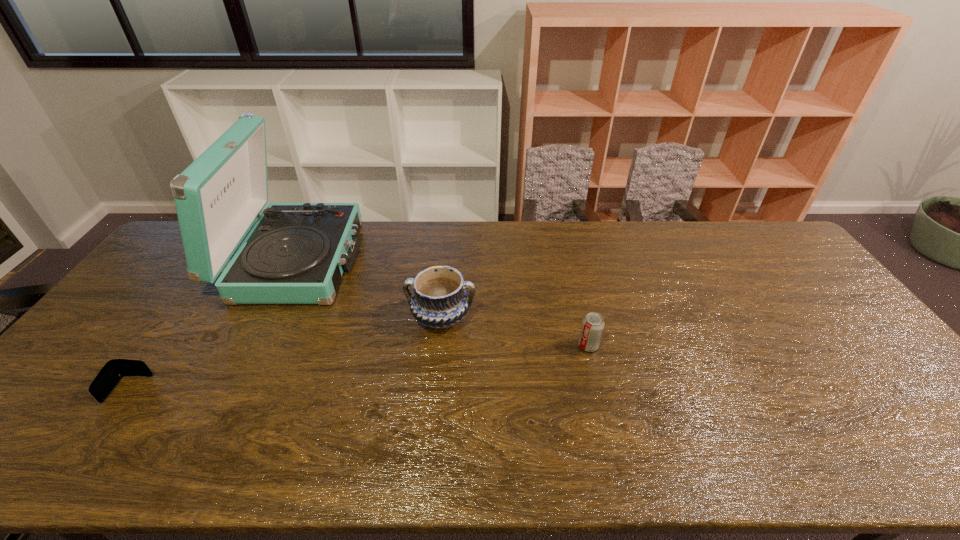
Find the location of a particular element. Image resolution: width=960 pixels, height=540 pixels. vacant space that satisfies the following two spatial constraints: 1. on the face side of the record player; 2. on the left side of the soda can is located at coordinates (253, 346).